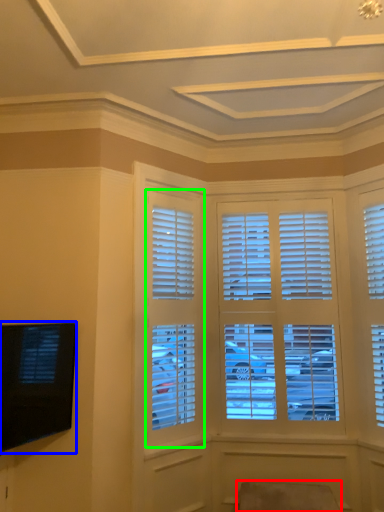
Question: Estimate the real-world distances between objects in this image. Which object is farther from swivel chair (highlighted by a red box), television (highlighted by a blue box) or window (highlighted by a green box)?

Choices:
 (A) television
 (B) window

Answer: (A)